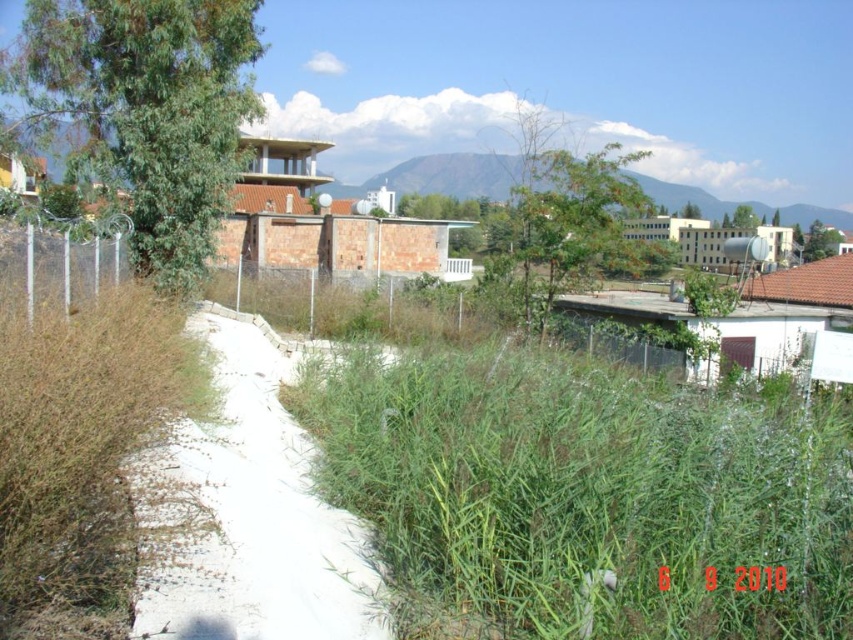
Question: Which object is farther from the camera taking this photo?

Choices:
 (A) white concrete path at center
 (B) green grassy hillside at upper center

Answer: (B)

Question: Is white concrete path at center positioned at the back of green grassy hillside at upper center?

Choices:
 (A) yes
 (B) no

Answer: (B)

Question: Is green grass at center to the left of white concrete path at center from the viewer's perspective?

Choices:
 (A) yes
 (B) no

Answer: (B)

Question: Which point is farther to the camera?

Choices:
 (A) click(223, 312)
 (B) click(677, 209)

Answer: (B)

Question: Which of the following is the farthest from the observer?

Choices:
 (A) green grassy hillside at upper center
 (B) green grass at center
 (C) white concrete path at center

Answer: (A)

Question: Can you confirm if green grass at center is positioned below green grassy hillside at upper center?

Choices:
 (A) no
 (B) yes

Answer: (B)